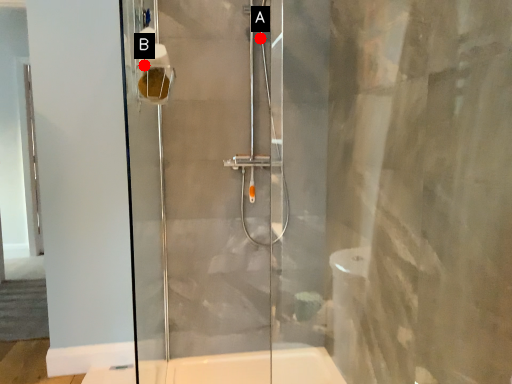
Question: Two points are circled on the image, labeled by A and B beside each circle. Which point is closer to the camera?

Choices:
 (A) A is closer
 (B) B is closer

Answer: (B)